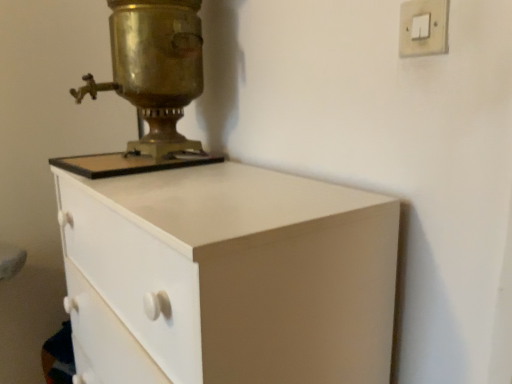
The width and height of the screenshot is (512, 384). I want to click on unoccupied area in front of brass/bronze metallic samovar at upper left, so click(153, 178).